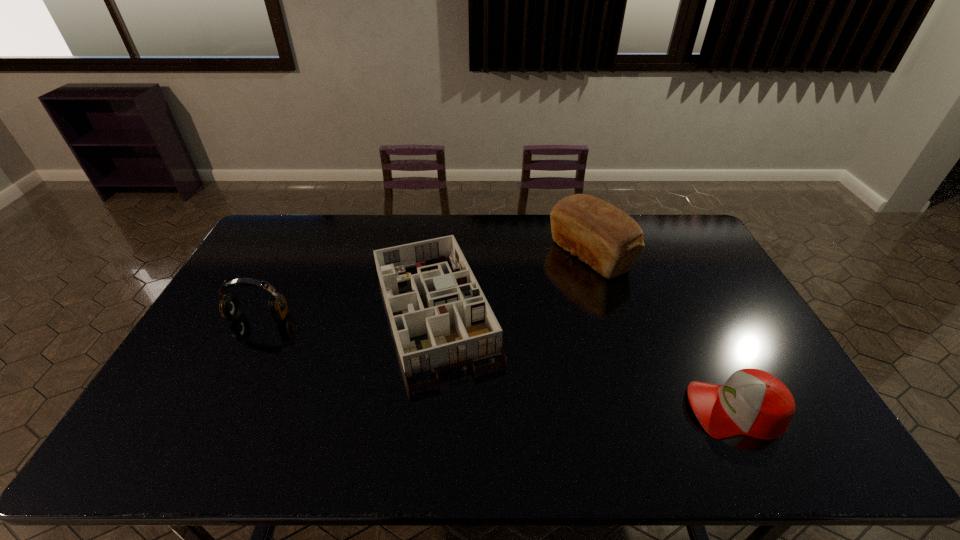
You are a GUI agent. You are given a task and a screenshot of the screen. Output one action in this format:
    pyautogui.click(x=<x>, y=<y>)
    Task: Click on the tallest object
    The image size is (960, 540).
    Given the screenshot: What is the action you would take?
    pyautogui.click(x=601, y=235)

Locate an element on the screen. Image resolution: width=960 pixels, height=540 pixels. the second tallest object is located at coordinates coord(230,308).

At what (x,y) coordinates should I click in order to perform the action: click on headset. Please return your answer as a coordinate pair (x, y). Looking at the image, I should click on (230, 308).

Where is `baseball cap`? The height and width of the screenshot is (540, 960). baseball cap is located at coordinates (752, 402).

Locate an element on the screen. This screenshot has height=540, width=960. the second object from left to right is located at coordinates (450, 307).

Identify the location of free region located 0.230m on the left of the tallest object. (486, 255).

The height and width of the screenshot is (540, 960). I want to click on vacant space situated 0.340m on the ear cups of the third shortest object, so click(201, 432).

This screenshot has height=540, width=960. What are the coordinates of `vacant space positioned on the front-facing side of the baseball cap` in the screenshot? It's located at (636, 409).

You are a GUI agent. You are given a task and a screenshot of the screen. Output one action in this format:
    pyautogui.click(x=<x>, y=<y>)
    Task: Click on the vacant space located on the front-facing side of the baseball cap
    The image size is (960, 540).
    Given the screenshot: What is the action you would take?
    pyautogui.click(x=641, y=409)

Image resolution: width=960 pixels, height=540 pixels. I want to click on free region located 0.160m on the front-facing side of the baseball cap, so click(x=625, y=409).